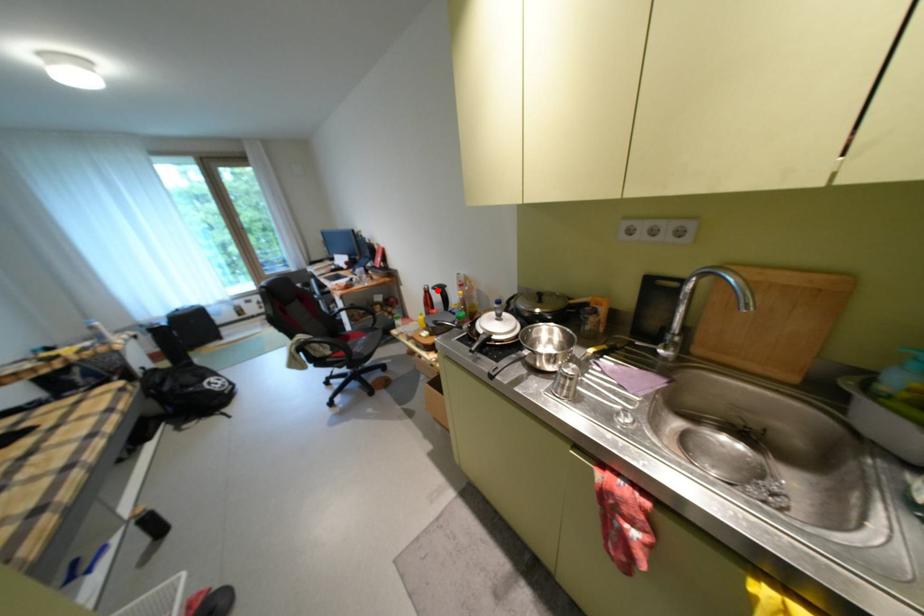
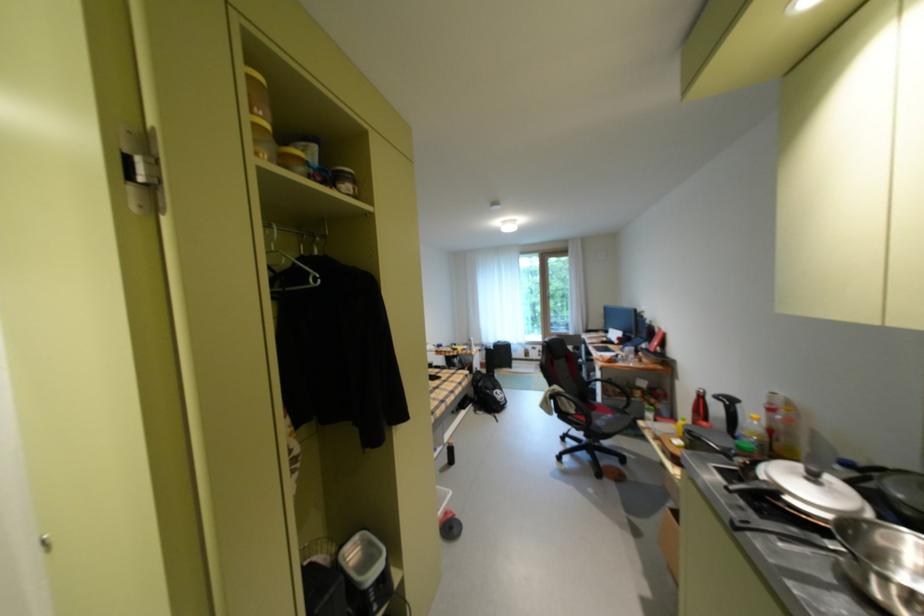
In the second image, find the point that corresponds to the highlighted location in the first image.

(712, 395)